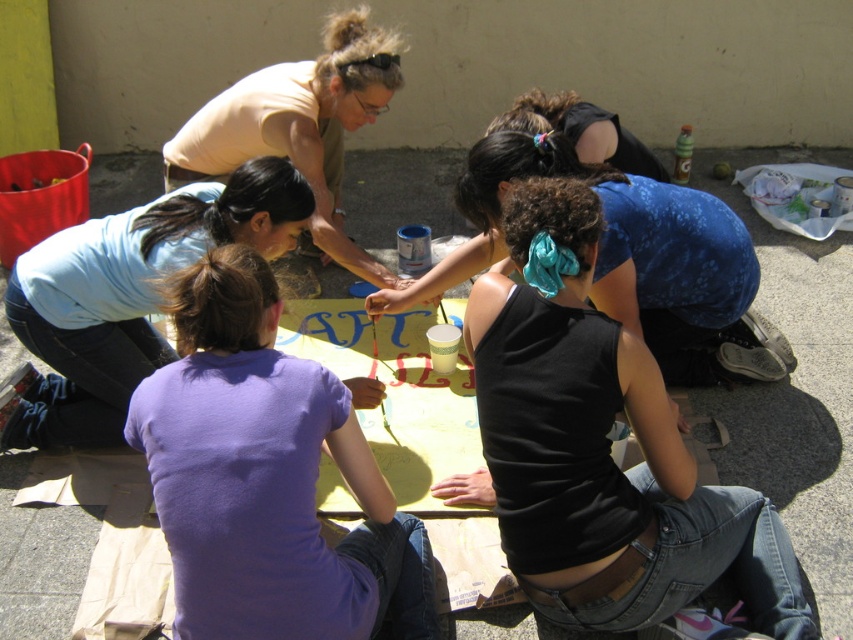
Does blue floral tank top at center lie behind light yellow t-shirt at upper left?

No, blue floral tank top at center is in front of light yellow t-shirt at upper left.

In the scene shown: Who is lower down, blue floral tank top at center or light yellow t-shirt at upper left?

blue floral tank top at center is lower down.

Where is `blue floral tank top at center`? This screenshot has width=853, height=640. blue floral tank top at center is located at coordinates (628, 260).

Find the location of a particular element. blue floral tank top at center is located at coordinates (628, 260).

Does purple cotton shirt at center have a larger size compared to light yellow t-shirt at upper left?

No.

Who is positioned more to the right, purple cotton shirt at center or light yellow t-shirt at upper left?

Positioned to the right is purple cotton shirt at center.

This screenshot has height=640, width=853. Find the location of `purple cotton shirt at center`. purple cotton shirt at center is located at coordinates (267, 477).

Where is `purple cotton shirt at center`? The width and height of the screenshot is (853, 640). purple cotton shirt at center is located at coordinates tap(267, 477).

Is black tank top at center above light yellow t-shirt at upper left?

No, black tank top at center is not above light yellow t-shirt at upper left.

Describe the element at coordinates (602, 449) in the screenshot. This screenshot has height=640, width=853. I see `black tank top at center` at that location.

The image size is (853, 640). Identify the location of black tank top at center. (602, 449).